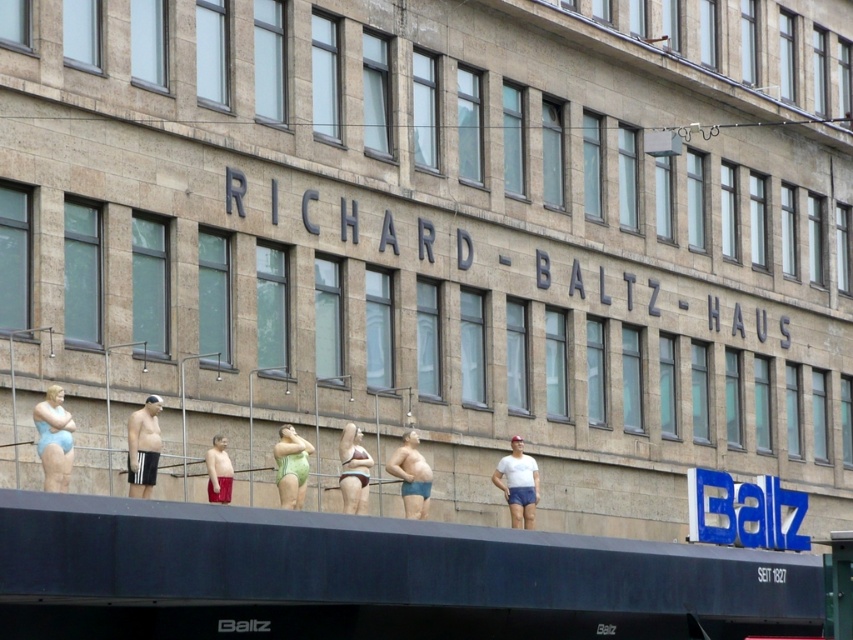
You are an artist planning to paint the two sculptures wearing black adidas shorts at left and matte blue shorts at center. Since you want to focus on the details of the shorts, which sculpture should you choose to paint first based on the size of their shorts?

The matte blue shorts at center are wider than the black adidas shorts at left, so you should paint the matte blue shorts at center first as they offer more surface area for detailed work.

You are a visitor standing in front of the RICHARD BALTZ HAUS building and want to take a photo of the matte blue swimsuit at left and the matte blue shorts at center. Which object should you zoom in on to capture more details of the figure wearing it?

The matte blue swimsuit at left has a lesser width compared to the matte blue shorts at center, so you should zoom in on the matte blue swimsuit at left to capture more details since it is smaller in size.